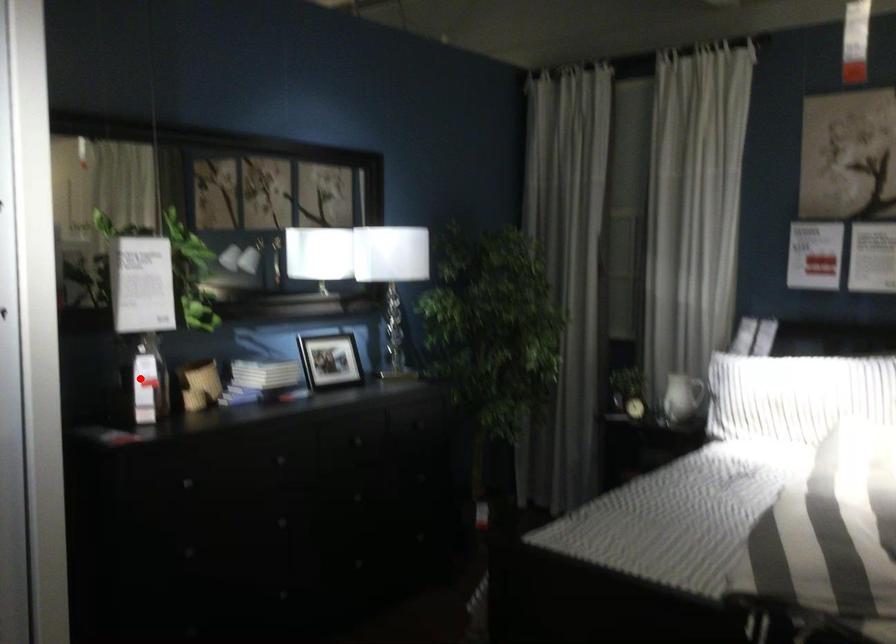
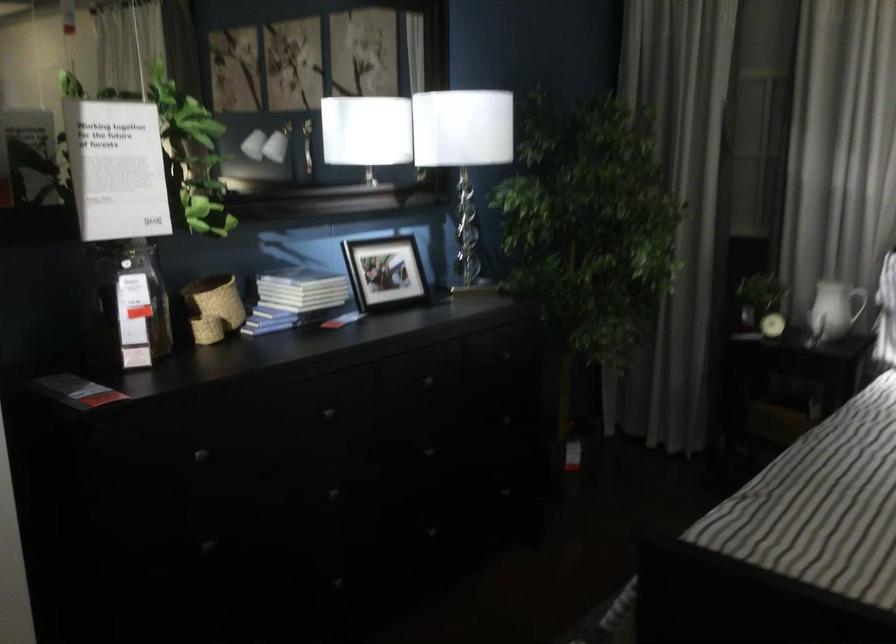
Question: I am providing you with two images of the same scene from different viewpoints. Given a red point in image1, look at the same physical point in image2. Is it:

Choices:
 (A) Closer to the viewpoint
 (B) Farther from the viewpoint

Answer: (A)